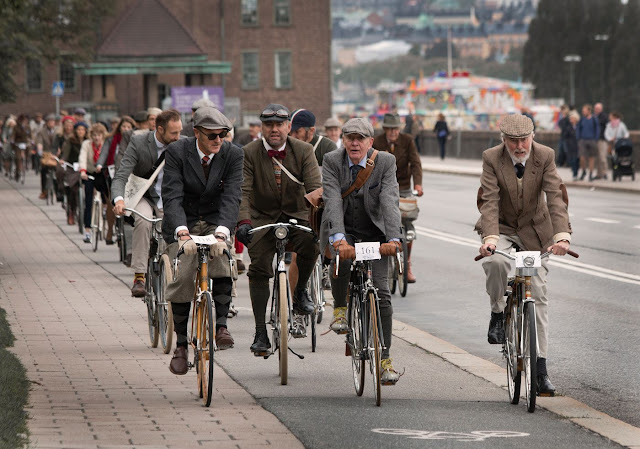
The image size is (640, 449). What are the coordinates of `windows` in the screenshot? It's located at 29,74, 66,83, 249,70, 283,70, 283,6, 246,8.